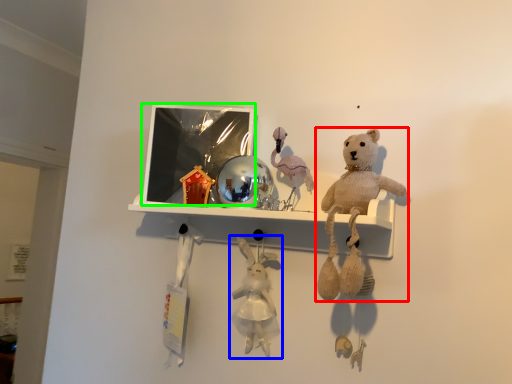
Question: Which is nearer to the teddy bear (highlighted by a red box)? toy (highlighted by a blue box) or picture frame (highlighted by a green box).

Choices:
 (A) toy
 (B) picture frame

Answer: (A)